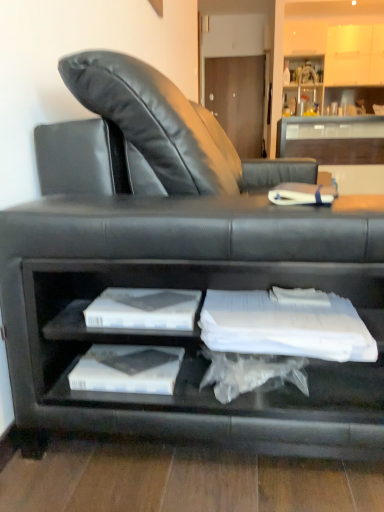
In order to face clear glass table at upper center, should I rotate leftwards or rightwards?

Turn right by 19.010 degrees to look at clear glass table at upper center.

Based on the photo, in order to face matte white cabinet at upper right, should I rotate leftwards or rightwards?

A 18.082 degree turn to the right will do.

Measure the distance between point (292, 195) and camera.

The distance of point (292, 195) from camera is 1.16 meters.

Identify the location of white paper at lower center. The image size is (384, 512). (201, 360).

Is white paper at center taller or shorter than clear glass table at upper center?

white paper at center is shorter than clear glass table at upper center.

Is white paper at center oriented away from clear glass table at upper center?

No, clear glass table at upper center is not at the back of white paper at center.

From the image's perspective, is white paper at center located above clear glass table at upper center?

No, from the image's perspective, white paper at center is not over clear glass table at upper center.

Does white paper at center touch clear glass table at upper center?

There is a gap between white paper at center and clear glass table at upper center.

Does matte white cabinet at upper right have a greater height compared to white paper at lower center?

Yes, matte white cabinet at upper right is taller than white paper at lower center.

How different are the orientations of matte white cabinet at upper right and white paper at lower center in degrees?

matte white cabinet at upper right and white paper at lower center are facing 89.9 degrees away from each other.

Is matte white cabinet at upper right facing away from white paper at lower center?

No, matte white cabinet at upper right is not facing away from white paper at lower center.

Is matte white cabinet at upper right thinner than white paper at lower center?

Yes, matte white cabinet at upper right is thinner than white paper at lower center.

Considering the positions of point (336, 125) and point (318, 188), is point (336, 125) closer or farther from the camera than point (318, 188)?

Clearly, point (336, 125) is more distant from the camera than point (318, 188).

Considering the relative sizes of clear glass table at upper center and white paper at center in the image provided, is clear glass table at upper center wider than white paper at center?

Indeed, clear glass table at upper center has a greater width compared to white paper at center.

Looking at the image, does clear glass table at upper center seem bigger or smaller compared to white paper at center?

Clearly, clear glass table at upper center is larger in size than white paper at center.

Is clear glass table at upper center situated inside matte white cabinet at upper right or outside?

The correct answer is: outside.

In the scene shown: Visually, is clear glass table at upper center positioned to the left or to the right of matte white cabinet at upper right?

Based on their positions, clear glass table at upper center is located to the left of matte white cabinet at upper right.

Is clear glass table at upper center positioned behind matte white cabinet at upper right?

No, clear glass table at upper center is closer to the viewer.

Where is `entertainment center to the right of clear glass table at upper center`? entertainment center to the right of clear glass table at upper center is located at coordinates (338, 38).

Measure the distance from white paper at center to white paper at lower center.

white paper at center is 4.35 feet away from white paper at lower center.

Between white paper at center and white paper at lower center, which one has smaller width?

Thinner between the two is white paper at center.

From the image's perspective, which one is positioned higher, white paper at center or white paper at lower center?

white paper at center.

Looking at this image, who is taller, white paper at center or white paper at lower center?

white paper at lower center.

Between matte white cabinet at upper right and white paper at center, which one has larger size?

Bigger between the two is matte white cabinet at upper right.

From the image's perspective, is matte white cabinet at upper right located above white paper at center?

Yes, from the image's perspective, matte white cabinet at upper right is on top of white paper at center.

Looking at this image, is white paper at center at the back of matte white cabinet at upper right?

No, white paper at center is not at the back of matte white cabinet at upper right.

Can you tell me how much matte white cabinet at upper right and white paper at center differ in facing direction?

79 degrees.

Identify the location of entertainment center located on the right of white paper at lower center. The width and height of the screenshot is (384, 512). pyautogui.click(x=338, y=38).

Which is more to the right, white paper at lower center or matte white cabinet at upper right?

Positioned to the right is matte white cabinet at upper right.

The height and width of the screenshot is (512, 384). I want to click on table that is on the right side of white paper at center, so click(333, 139).

Identify the location of cabinet on the left of matte white cabinet at upper right. The image size is (384, 512). (201, 360).

When comparing their distances from matte white cabinet at upper right, does white paper at lower center or white paper at center seem closer?

white paper at center is positioned closer to the anchor matte white cabinet at upper right.

From the image, which object appears to be nearer to white paper at center, matte white cabinet at upper right or clear glass table at upper center?

clear glass table at upper center is positioned closer to the anchor white paper at center.

When comparing their distances from white paper at lower center, does matte white cabinet at upper right or white paper at center seem closer?

white paper at center is positioned closer to the anchor white paper at lower center.

Considering their positions, is white paper at center positioned closer to matte white cabinet at upper right than white paper at lower center?

Based on the image, white paper at center appears to be nearer to matte white cabinet at upper right.

Considering their positions, is clear glass table at upper center positioned closer to white paper at center than matte white cabinet at upper right?

Among the two, clear glass table at upper center is located nearer to white paper at center.

When comparing their distances from clear glass table at upper center, does matte white cabinet at upper right or white paper at center seem closer?

Based on the image, white paper at center appears to be nearer to clear glass table at upper center.

In the scene shown: Based on their spatial positions, is clear glass table at upper center or white paper at center closer to white paper at lower center?

white paper at center is positioned closer to the anchor white paper at lower center.

Estimate the real-world distances between objects in this image. Which object is closer to white paper at center, white paper at lower center or clear glass table at upper center?

white paper at lower center lies closer to white paper at center than the other object.

I want to click on table located between white paper at center and matte white cabinet at upper right in the depth direction, so click(333, 139).

Locate an element on the screen. The width and height of the screenshot is (384, 512). book between white paper at lower center and matte white cabinet at upper right in the front-back direction is located at coordinates (302, 194).

The height and width of the screenshot is (512, 384). In order to click on book between white paper at lower center and clear glass table at upper center from front to back in this screenshot , I will do `click(302, 194)`.

This screenshot has height=512, width=384. I want to click on table between white paper at lower center and matte white cabinet at upper right along the z-axis, so click(x=333, y=139).